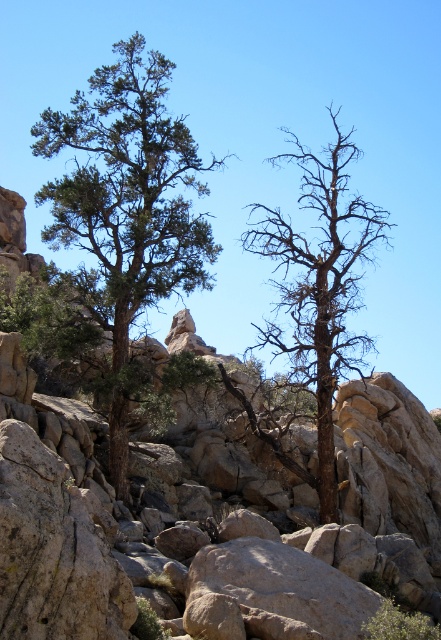
Is green textured tree at center closer to camera compared to brown/dry wood tree at center?

No, it is behind brown/dry wood tree at center.

Can you confirm if green textured tree at center is wider than brown/dry wood tree at center?

No.

What do you see at coordinates (127, 202) in the screenshot? Image resolution: width=441 pixels, height=640 pixels. I see `green textured tree at center` at bounding box center [127, 202].

The height and width of the screenshot is (640, 441). I want to click on green textured tree at center, so click(127, 202).